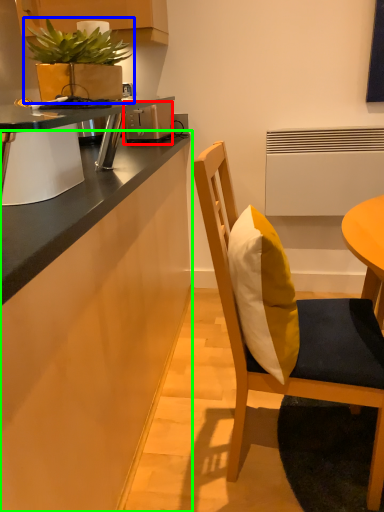
Question: Estimate the real-world distances between objects in this image. Which object is closer to toaster (highlighted by a red box), houseplant (highlighted by a blue box) or cabinetry (highlighted by a green box)?

Choices:
 (A) houseplant
 (B) cabinetry

Answer: (A)